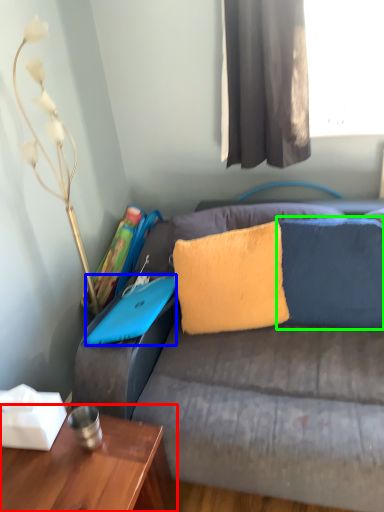
Question: Considering the real-world distances, which object is closest to table (highlighted by a red box)? laptop (highlighted by a blue box) or pillow (highlighted by a green box).

Choices:
 (A) laptop
 (B) pillow

Answer: (A)